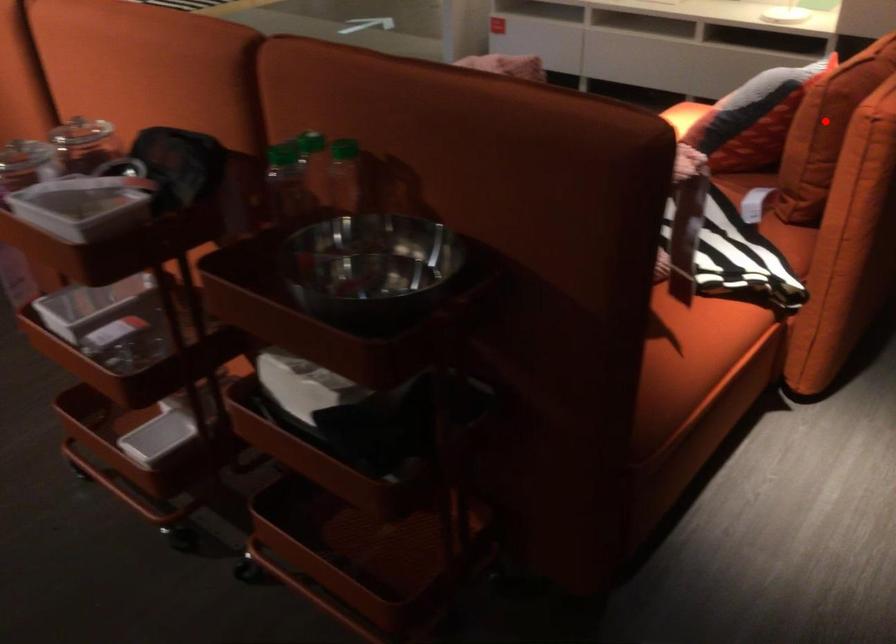
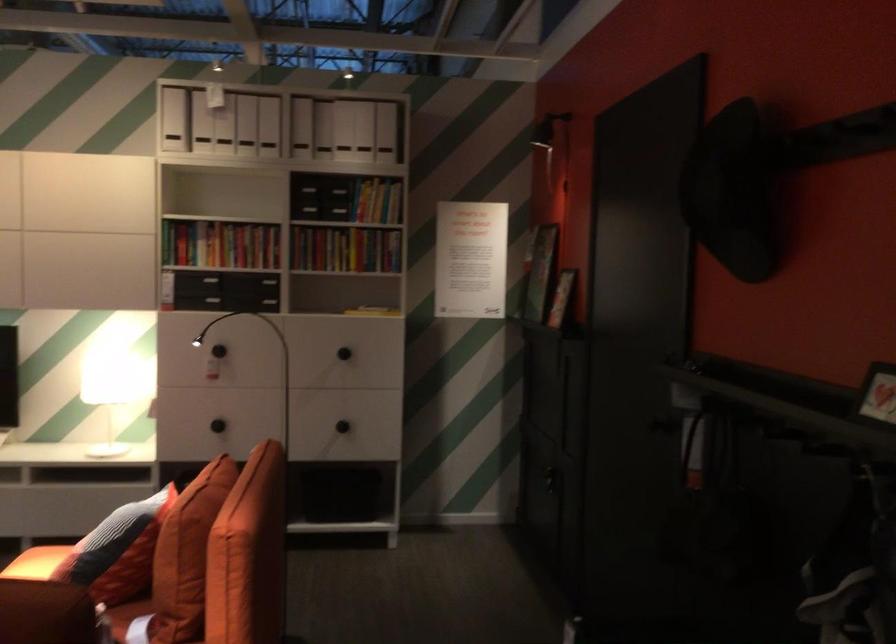
Question: A red point is marked in image1. In image2, is the corresponding 3D point closer to the camera or farther? Reply with the corresponding letter.

Choices:
 (A) The corresponding 3D point is closer.
 (B) The corresponding 3D point is farther.

Answer: (B)